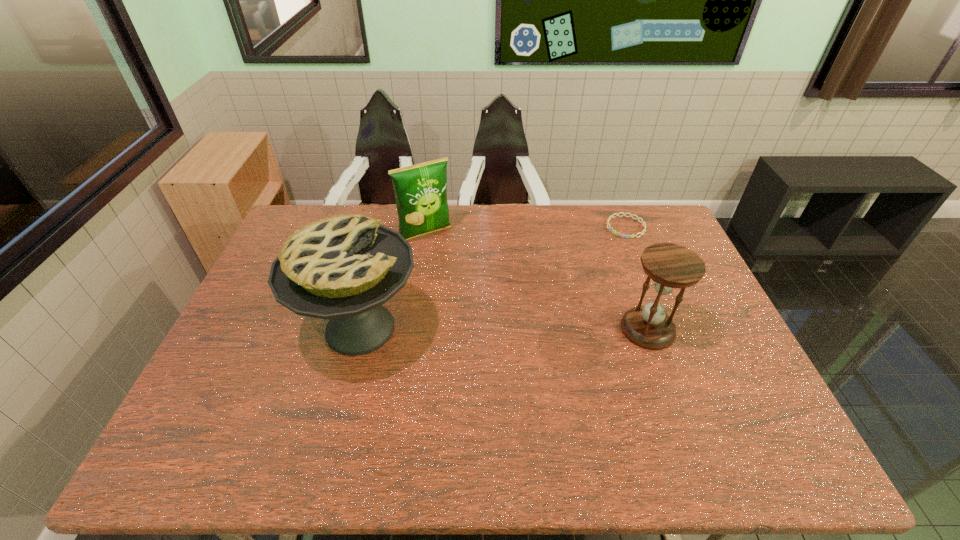
Identify the location of pie. The image size is (960, 540). (344, 268).

You are a GUI agent. You are given a task and a screenshot of the screen. Output one action in this format:
    pyautogui.click(x=<x>, y=<y>)
    Task: Click on the hourglass
    The image size is (960, 540).
    Given the screenshot: What is the action you would take?
    pyautogui.click(x=670, y=266)

You are a GUI agent. You are given a task and a screenshot of the screen. Output one action in this format:
    pyautogui.click(x=<x>, y=<y>)
    Task: Click on the shortest object
    Image resolution: width=960 pixels, height=540 pixels.
    Given the screenshot: What is the action you would take?
    pyautogui.click(x=644, y=225)

At what (x,y) coordinates should I click in order to perform the action: click on crisp (potato chip). Please return your answer as a coordinate pair (x, y). Image resolution: width=960 pixels, height=540 pixels. Looking at the image, I should click on (420, 190).

In order to click on vacant space located 0.240m on the cut side of the pie in this screenshot , I will do `click(509, 328)`.

Where is `vacant region located 0.120m on the back of the hourglass`? vacant region located 0.120m on the back of the hourglass is located at coordinates (631, 281).

Identify the location of free spot located on the surface of the bracelet showing star-shaped elements. This screenshot has height=540, width=960. click(x=604, y=255).

The height and width of the screenshot is (540, 960). Identify the location of vacant space situated on the surface of the bracelet showing star-shaped elements. (584, 280).

Identify the location of blank space located 0.390m on the surface of the bracelet showing star-shaped elements. (565, 303).

At what (x,y) coordinates should I click in order to perform the action: click on vacant space located 0.220m on the front-facing side of the crisp (potato chip). Please return your answer as a coordinate pair (x, y). Image resolution: width=960 pixels, height=540 pixels. Looking at the image, I should click on (464, 284).